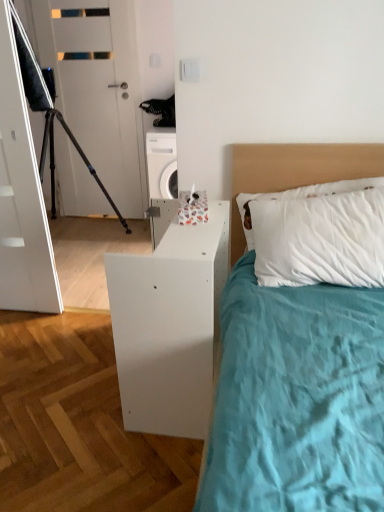
Question: Is white matte nightstand at lower right touching black matte tripod at left?

Choices:
 (A) yes
 (B) no

Answer: (B)

Question: Is white matte nightstand at lower right positioned before black matte tripod at left?

Choices:
 (A) yes
 (B) no

Answer: (A)

Question: Is white matte nightstand at lower right aimed at black matte tripod at left?

Choices:
 (A) no
 (B) yes

Answer: (A)

Question: Considering the relative sizes of white matte nightstand at lower right and black matte tripod at left in the image provided, is white matte nightstand at lower right wider than black matte tripod at left?

Choices:
 (A) yes
 (B) no

Answer: (B)

Question: From the image's perspective, would you say white matte nightstand at lower right is shown under black matte tripod at left?

Choices:
 (A) yes
 (B) no

Answer: (A)

Question: Can you confirm if white matte nightstand at lower right is shorter than black matte tripod at left?

Choices:
 (A) no
 (B) yes

Answer: (B)

Question: Is white matte headboard at upper right far away from white matte nightstand at lower right?

Choices:
 (A) yes
 (B) no

Answer: (B)

Question: From a real-world perspective, is white matte headboard at upper right beneath white matte nightstand at lower right?

Choices:
 (A) yes
 (B) no

Answer: (B)

Question: Does white matte headboard at upper right come in front of white matte nightstand at lower right?

Choices:
 (A) yes
 (B) no

Answer: (B)

Question: Does white matte headboard at upper right appear on the left side of white matte nightstand at lower right?

Choices:
 (A) no
 (B) yes

Answer: (A)

Question: Would you say white matte headboard at upper right contains white matte nightstand at lower right?

Choices:
 (A) no
 (B) yes

Answer: (A)

Question: Considering the relative sizes of white matte headboard at upper right and white matte nightstand at lower right in the image provided, is white matte headboard at upper right bigger than white matte nightstand at lower right?

Choices:
 (A) no
 (B) yes

Answer: (A)

Question: Does white matte door at upper left have a larger size compared to white matte nightstand at lower right?

Choices:
 (A) yes
 (B) no

Answer: (B)